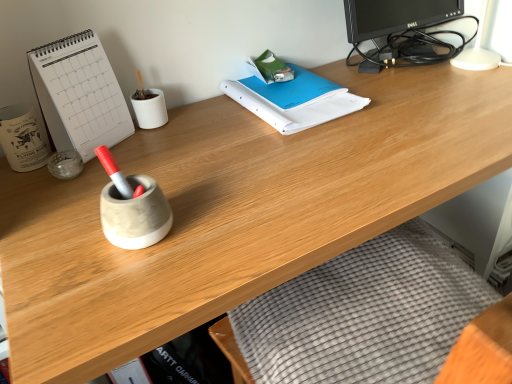
Image resolution: width=512 pixels, height=384 pixels. In order to click on vacant area located to the right-hand side of white paper at left in this screenshot , I will do `click(174, 146)`.